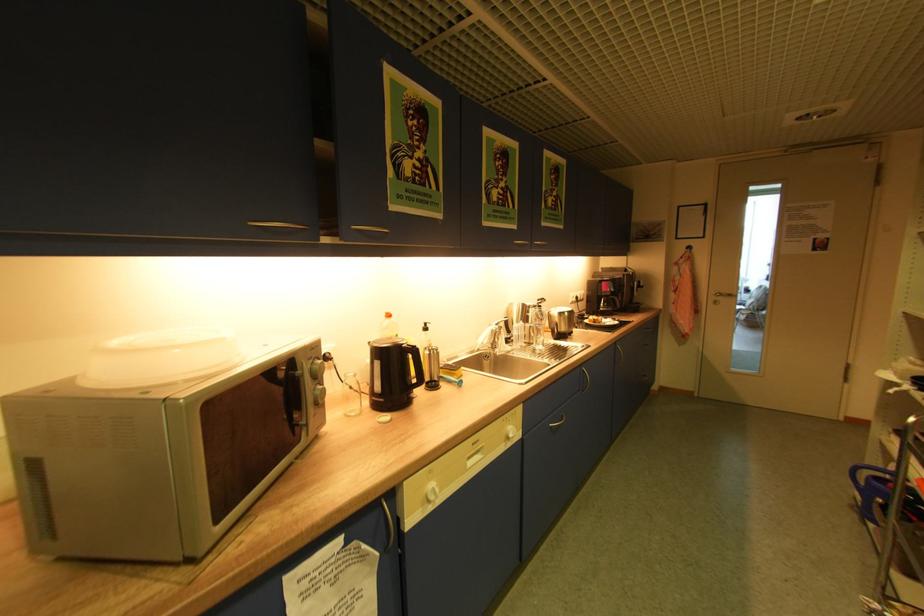
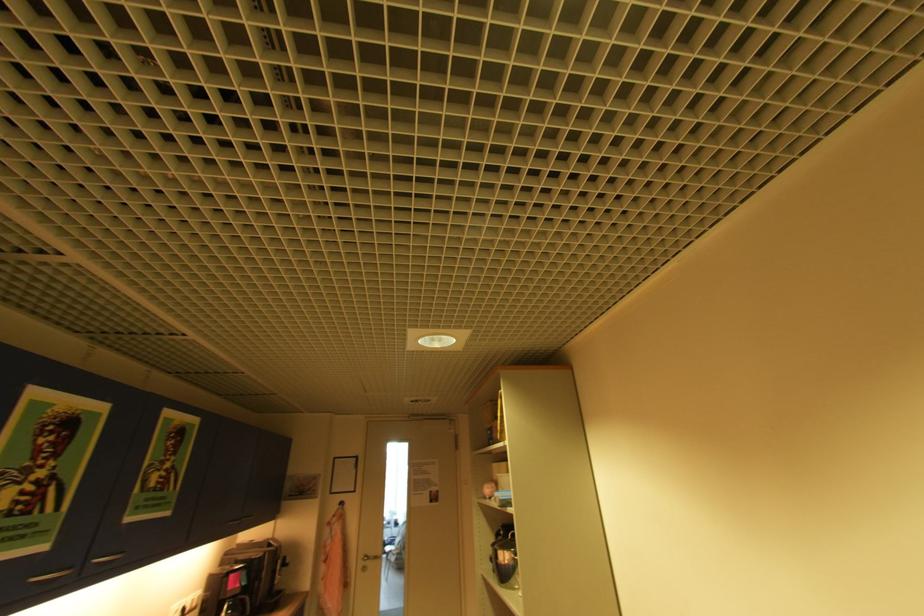
How did the camera likely rotate?

The rotation direction of the camera is right-up.